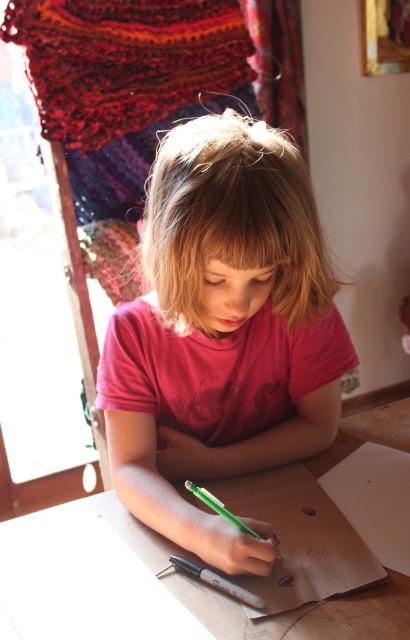
Looking at this image, is pink matte shirt at center to the left of green plastic pencil at lower center from the viewer's perspective?

No, pink matte shirt at center is not to the left of green plastic pencil at lower center.

Is point (264, 148) farther from viewer compared to point (216, 502)?

No.

Between point (307, 177) and point (211, 508), which one is positioned in front?

Point (307, 177) is more forward.

What are the coordinates of `pink matte shirt at center` in the screenshot? It's located at (223, 332).

Does pink matte shirt at center come behind green matte pen at lower center?

That is False.

Is point (136, 456) positioned before point (230, 588)?

No, (136, 456) is behind (230, 588).

Between point (168, 278) and point (225, 582), which one is positioned in front?

Point (225, 582)

Locate an element on the screen. The height and width of the screenshot is (640, 410). pink matte shirt at center is located at coordinates (223, 332).

The height and width of the screenshot is (640, 410). What do you see at coordinates (223, 332) in the screenshot? I see `pink matte shirt at center` at bounding box center [223, 332].

Between point (255, 436) and point (68, 508), which one is positioned behind?

Point (255, 436)

Identify the location of pink matte shirt at center. This screenshot has width=410, height=640. click(x=223, y=332).